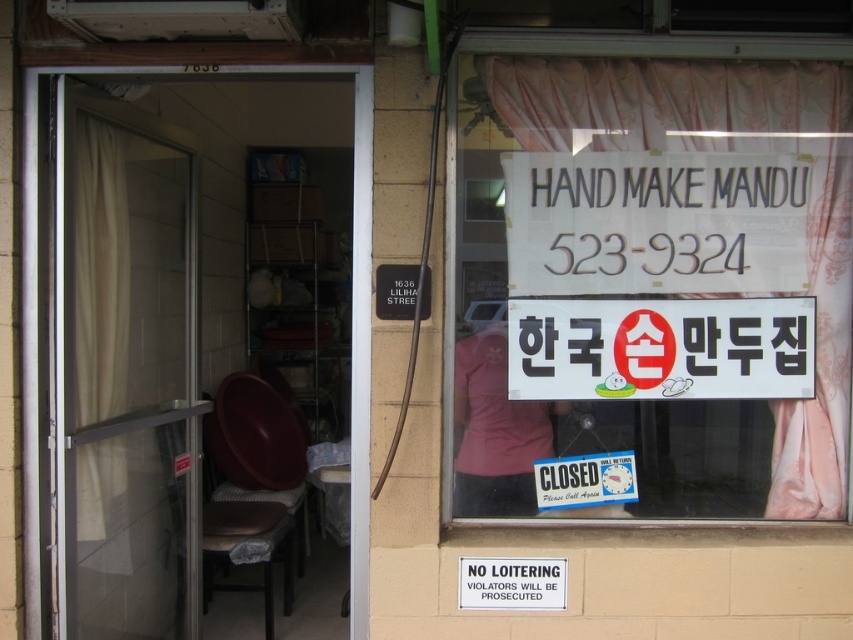
Is transparent glass door at left smaller than white paper sign at upper right?

Actually, transparent glass door at left might be larger than white paper sign at upper right.

Does point (299, 448) come farther from viewer compared to point (610, 120)?

Yes.

Where is `transparent glass door at left`? This screenshot has width=853, height=640. transparent glass door at left is located at coordinates (198, 348).

Which is below, white plastic sign at upper center or beige fabric curtain at left?

Positioned lower is white plastic sign at upper center.

Is white plastic sign at upper center further to the viewer compared to beige fabric curtain at left?

Yes, it is.

Which is in front, point (567, 355) or point (91, 470)?

Positioned in front is point (567, 355).

Identify the location of white plastic sign at upper center. This screenshot has height=640, width=853. (660, 348).

The height and width of the screenshot is (640, 853). What do you see at coordinates (198, 348) in the screenshot?
I see `transparent glass door at left` at bounding box center [198, 348].

Measure the distance between transparent glass door at left and beige fabric curtain at left.

transparent glass door at left is 27.31 inches from beige fabric curtain at left.

Where is `transparent glass door at left`? The width and height of the screenshot is (853, 640). transparent glass door at left is located at coordinates (198, 348).

I want to click on transparent glass door at left, so click(x=198, y=348).